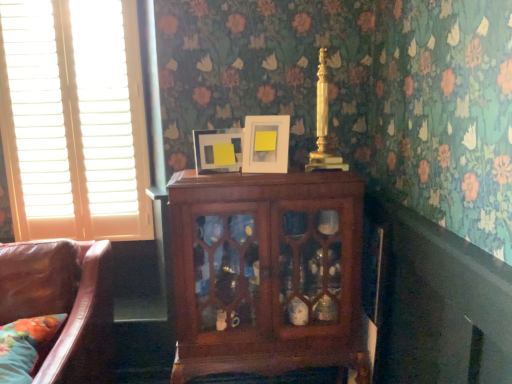
Question: From the image's perspective, is floral fabric pillow at lower left located above or below white wood blinds at left?

Choices:
 (A) above
 (B) below

Answer: (B)

Question: From their relative heights in the image, would you say floral fabric pillow at lower left is taller or shorter than white wood blinds at left?

Choices:
 (A) short
 (B) tall

Answer: (A)

Question: Which is nearer to the gold polished candle holder at upper center?

Choices:
 (A) matte white picture frame at center, the first picture frame when ordered from left to right
 (B) white wood blinds at left
 (C) matte white picture frame at upper center, which is counted as the 1th picture frame, starting from the right
 (D) mahogany cabinet at center
 (E) floral fabric pillow at lower left

Answer: (C)

Question: Considering the real-world distances, which object is farthest from the white wood blinds at left?

Choices:
 (A) matte white picture frame at center, the first picture frame when ordered from left to right
 (B) gold polished candle holder at upper center
 (C) mahogany cabinet at center
 (D) matte white picture frame at upper center, the 2th picture frame viewed from the left
 (E) floral fabric pillow at lower left

Answer: (B)